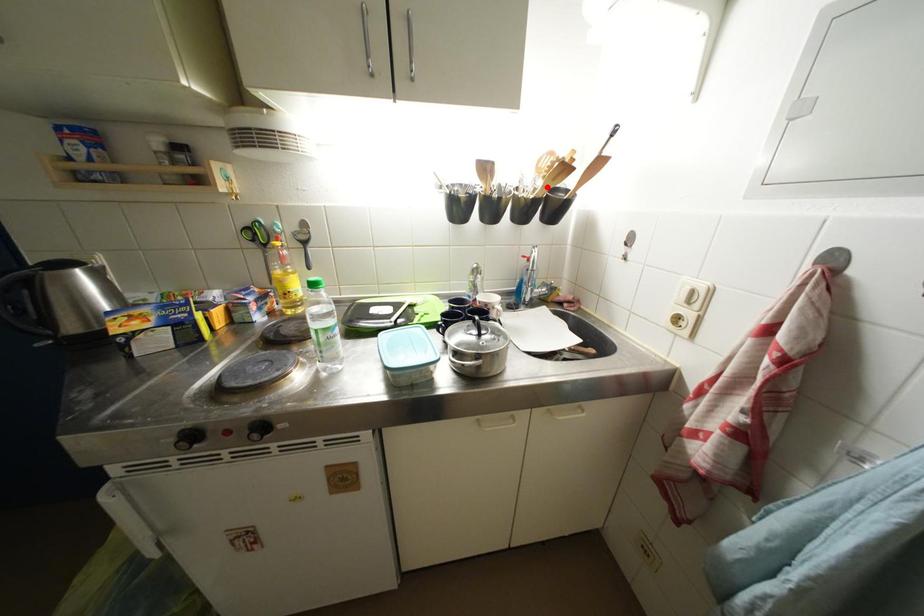
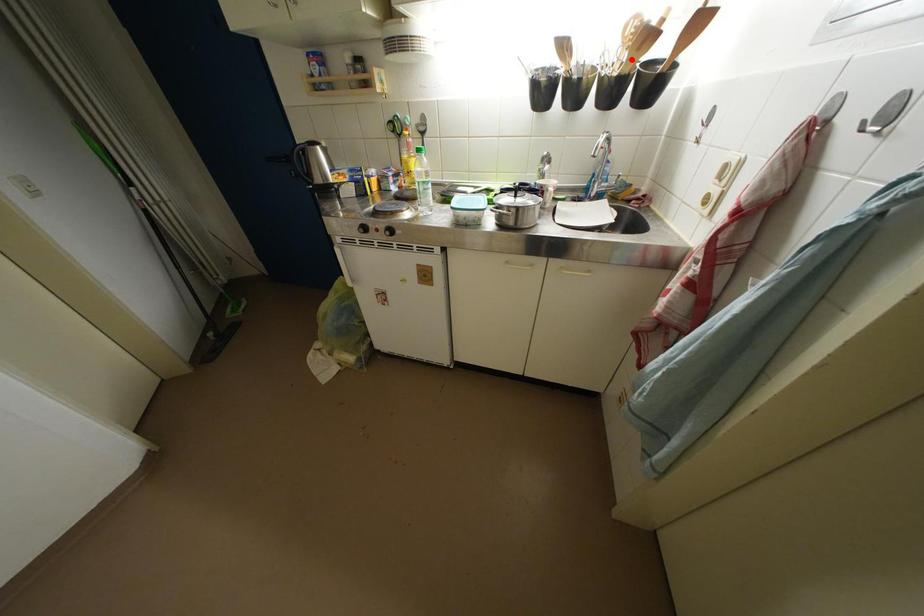
In the scene shown: I am providing you with two images of the same scene from different viewpoints. A red point is marked on the first image and another point is marked on the second image. Are the points marked in image1 and image2 representing the same 3D position?

Yes